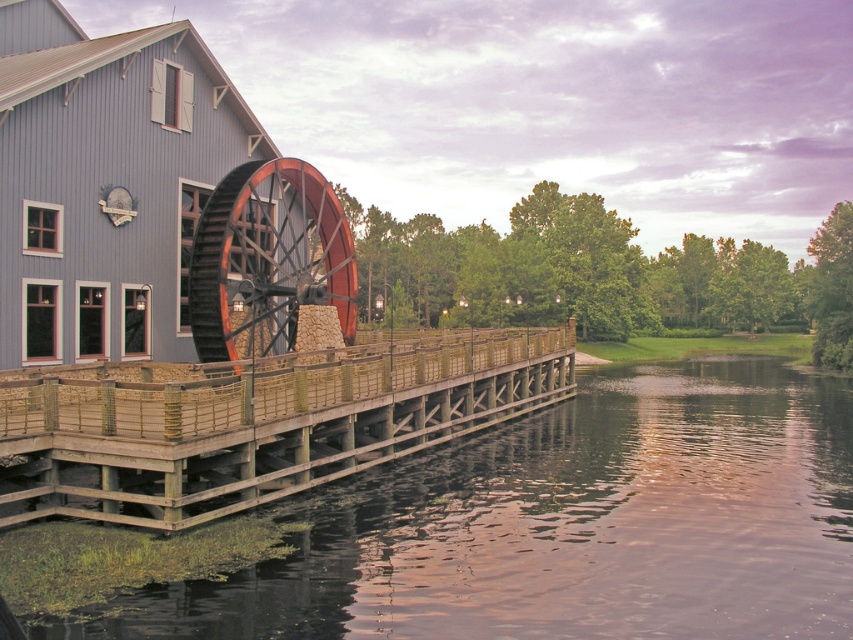
Question: Which point is closer to the camera taking this photo?

Choices:
 (A) (196, 460)
 (B) (415, 625)

Answer: (B)

Question: Is the position of smooth dark water at center less distant than that of wooden dock at lower left?

Choices:
 (A) yes
 (B) no

Answer: (A)

Question: Can you confirm if wooden dock at lower left is wider than wooden waterwheel at center?

Choices:
 (A) no
 (B) yes

Answer: (B)

Question: Which point is closer to the camera?

Choices:
 (A) (459, 513)
 (B) (291, 195)

Answer: (A)

Question: From the image, what is the correct spatial relationship of smooth dark water at center in relation to wooden dock at lower left?

Choices:
 (A) above
 (B) below

Answer: (B)

Question: Which point appears farthest from the camera in this image?

Choices:
 (A) (321, 474)
 (B) (289, 515)
 (C) (350, 330)

Answer: (C)